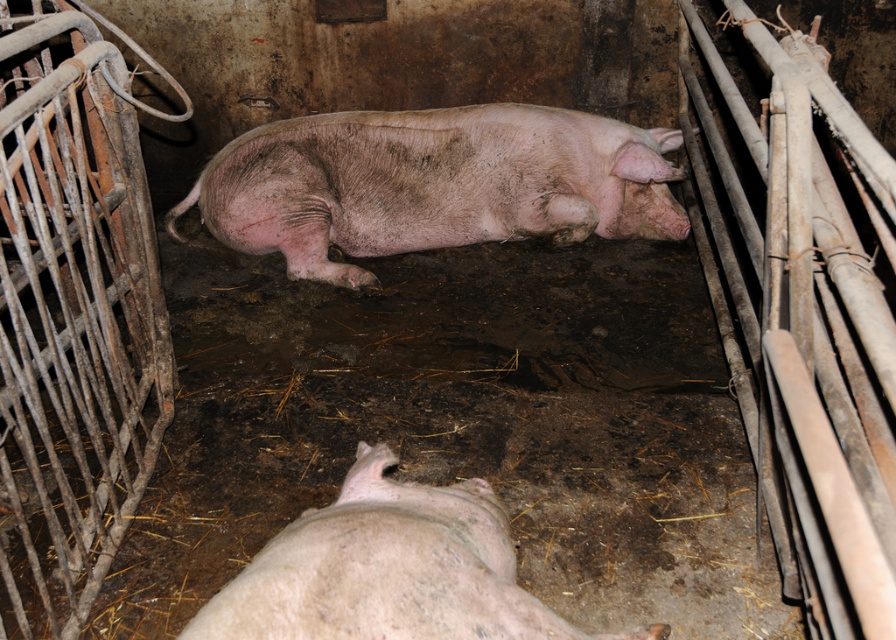
Does pink matte pig at center appear over pink matte pig at lower center?

Indeed, pink matte pig at center is positioned over pink matte pig at lower center.

Measure the distance between pink matte pig at center and camera.

3.80 meters

The height and width of the screenshot is (640, 896). In order to click on pink matte pig at center in this screenshot , I will do `click(432, 182)`.